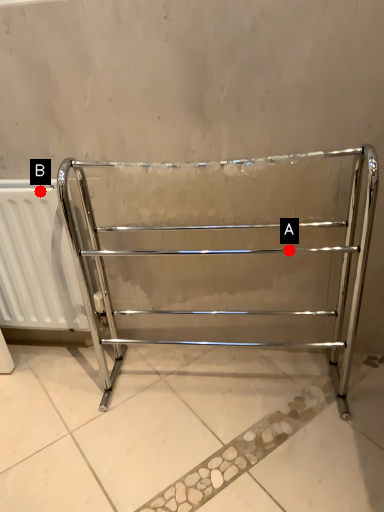
Question: Two points are circled on the image, labeled by A and B beside each circle. Among these points, which one is nearest to the camera?

Choices:
 (A) A is closer
 (B) B is closer

Answer: (B)